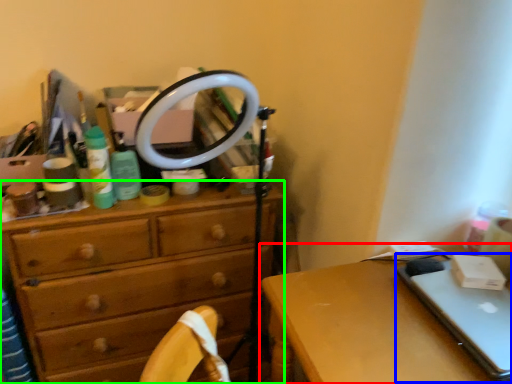
Question: Considering the real-world distances, which object is closest to desk (highlighted by a red box)? laptop (highlighted by a blue box) or chest of drawers (highlighted by a green box).

Choices:
 (A) laptop
 (B) chest of drawers

Answer: (A)